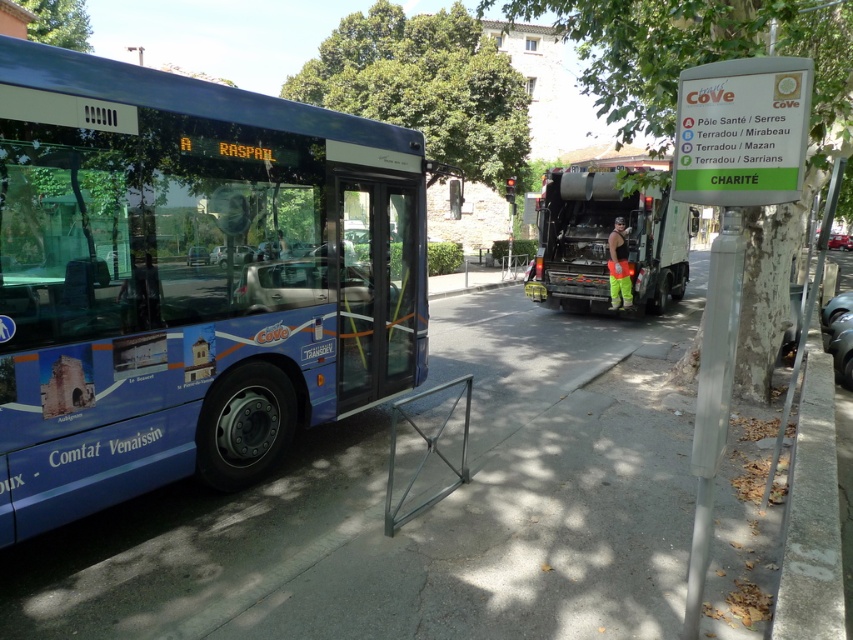
You are a city planner assessing the width of vehicles for road design. You observe the blue metallic bus at left and the blue painted bus at center in the scene. Which vehicle has a narrower width?

The blue metallic bus at left is thinner than the blue painted bus at center, so the blue metallic bus at left has a narrower width.

You are standing at the point marked as point [311,278]. You want to walk to the bus stop located 16.88 feet away from you. Is the bus stop in the direction of the bus or the garbage truck?

The bus stop is 16.88 feet away from point [311,278], which is the same distance mentioned in the description. Since the bus is on the left side of the frame and the garbage truck isn